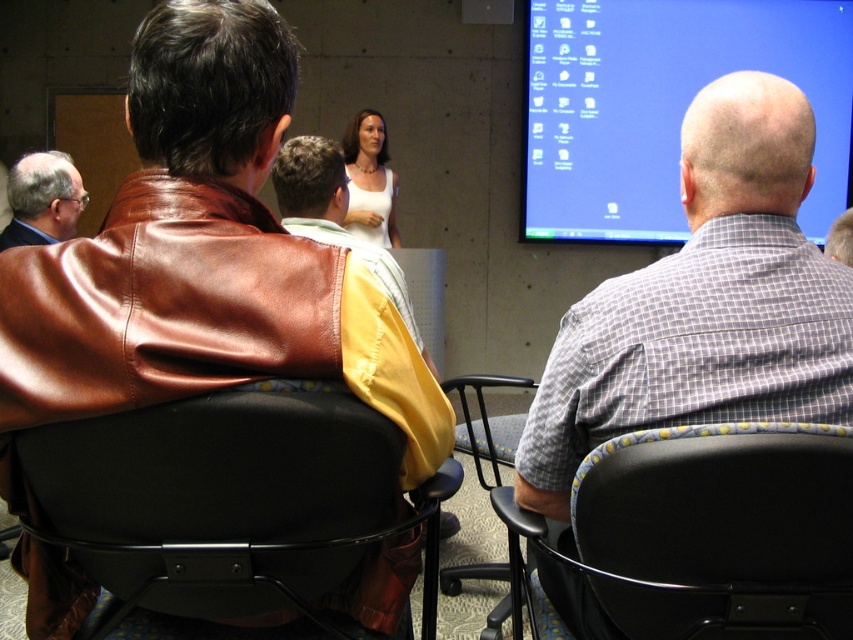
Question: Which of the following is the closest to the observer?

Choices:
 (A) tap(608, 74)
 (B) tap(393, 184)

Answer: (B)

Question: Does gray checkered shirt at right have a smaller size compared to black plastic chair at center?

Choices:
 (A) no
 (B) yes

Answer: (B)

Question: Can you confirm if black plastic chair at lower right is positioned above white matte dress at center?

Choices:
 (A) yes
 (B) no

Answer: (B)

Question: Which object is closer to the camera taking this photo?

Choices:
 (A) matte brown leather jacket at left
 (B) blue glossy monitor at upper right
 (C) brown leather jacket at center

Answer: (C)

Question: Is blue glossy monitor at upper right further to the viewer compared to black plastic chair at center?

Choices:
 (A) no
 (B) yes

Answer: (B)

Question: Based on their relative distances, which object is nearer to the black leather chair at lower left?

Choices:
 (A) gray checkered shirt at upper right
 (B) white matte dress at center
 (C) brown leather jacket at upper left

Answer: (C)